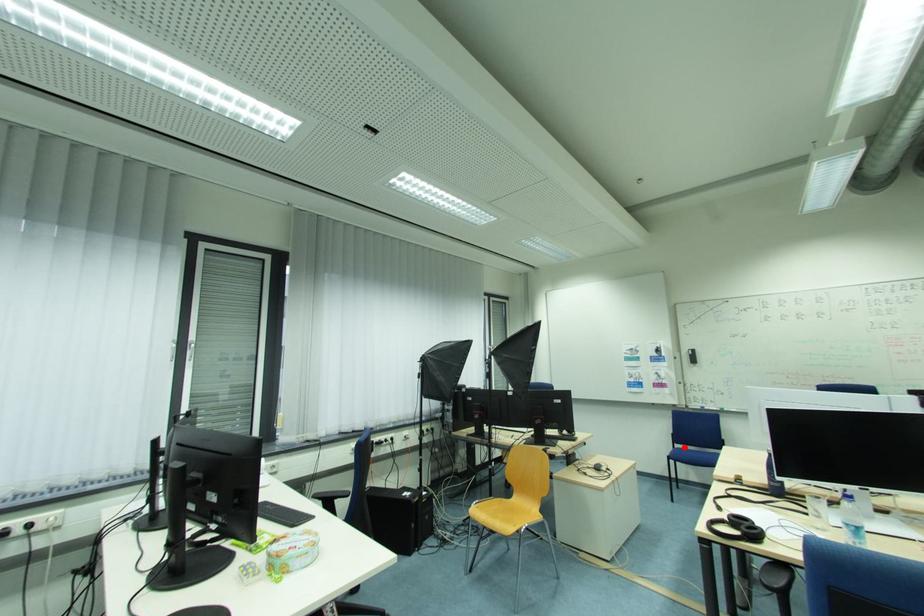
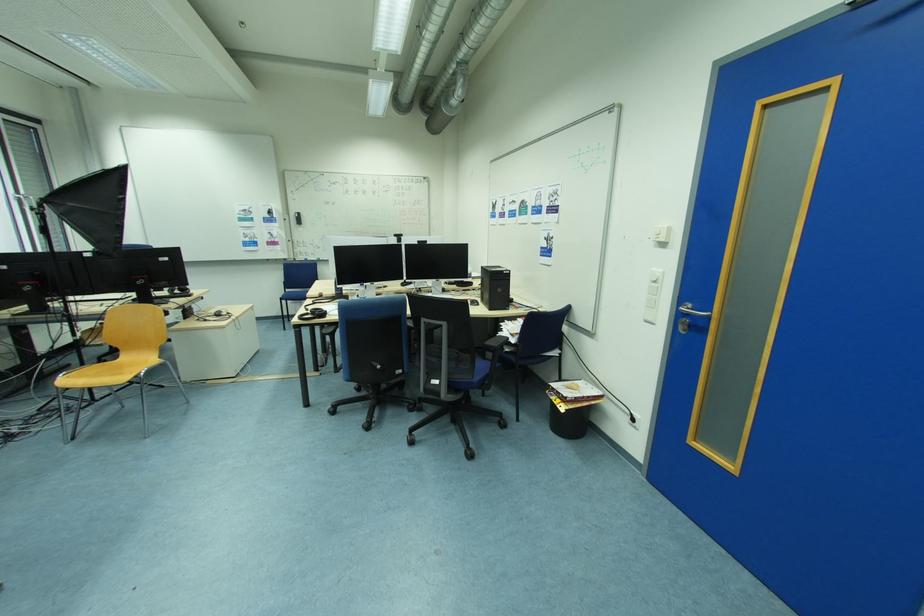
Where in the second image is the point corresponding to the highlighted location from the first image?

(295, 292)